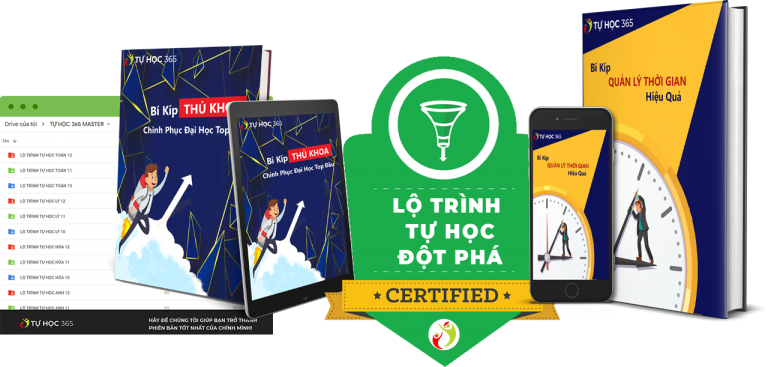
Locate an element on the screen. The height and width of the screenshot is (367, 768). lamp is located at coordinates (435, 109).